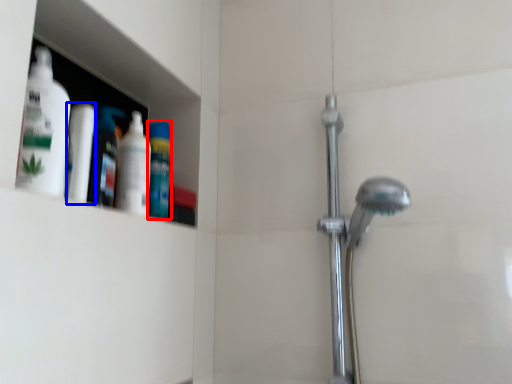
Question: Which of the following is the farthest to the observer, mouthwash (highlighted by a red box) or mouthwash (highlighted by a blue box)?

Choices:
 (A) mouthwash
 (B) mouthwash

Answer: (A)